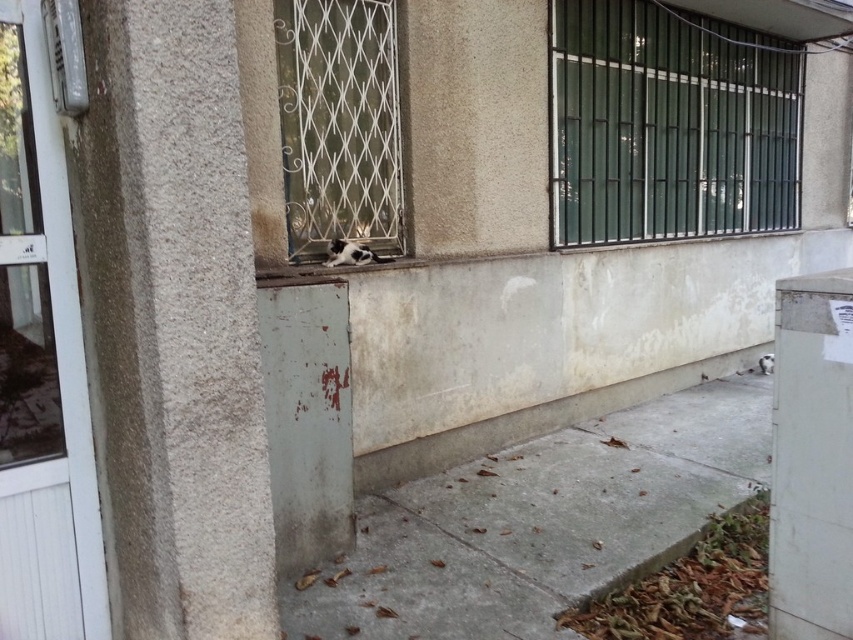
Question: Based on their relative distances, which object is nearer to the black and white fur cat at center?

Choices:
 (A) gray concrete pavement at lower right
 (B) metallic mesh window at center
 (C) green metal bars at upper right

Answer: (B)

Question: Which object appears closest to the camera in this image?

Choices:
 (A) black and white fur cat at center
 (B) metallic mesh window at center

Answer: (B)

Question: From the image, what is the correct spatial relationship of gray concrete pavement at lower right in relation to green metal bars at upper right?

Choices:
 (A) left
 (B) right

Answer: (A)

Question: Where is green metal bars at upper right located in relation to metallic mesh window at center in the image?

Choices:
 (A) left
 (B) right

Answer: (B)

Question: Which object appears closest to the camera in this image?

Choices:
 (A) metallic mesh window at center
 (B) gray concrete pavement at lower right

Answer: (B)

Question: Does green metal bars at upper right appear on the left side of black and white fur cat at center?

Choices:
 (A) no
 (B) yes

Answer: (A)